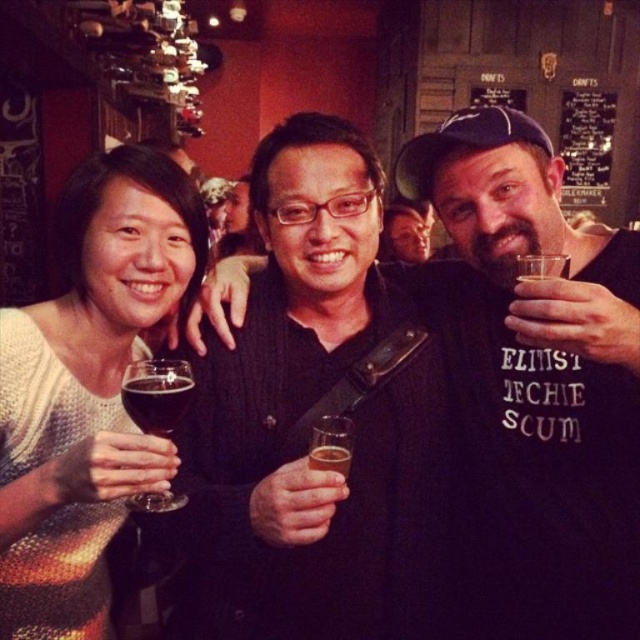
You are a photographer standing in front of the bar. You want to take a closeup photo of the knitted sweater at left without moving the subject. Can you get a clear shot if your camera has a minimum focusing distance of 80 centimeters?

The knitted sweater at left is 83.23 centimeters away from the camera. Since the minimum focusing distance is 80 centimeters, the camera can focus on the knitted sweater at left as it is within range.

Based on the photo, you are a photographer standing in front of the bar. You want to take a photo of the knitted sweater at left and the dark glass at left. The minimum distance your camera requires between two objects to focus on both clearly is 8 inches. Can you focus on both objects with your current camera settings?

The knitted sweater at left and dark glass at left are 8.49 inches apart, which is more than the 8 inch minimum required by the camera. Therefore, the camera can focus on both objects clearly.